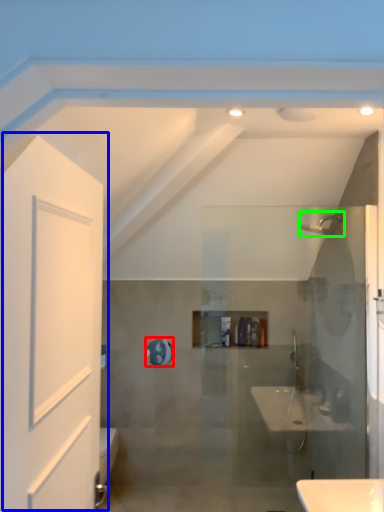
Question: Which object is the farthest from mirror (highlighted by a red box)? Choose among these: door (highlighted by a blue box) or shower (highlighted by a green box).

Choices:
 (A) door
 (B) shower

Answer: (A)